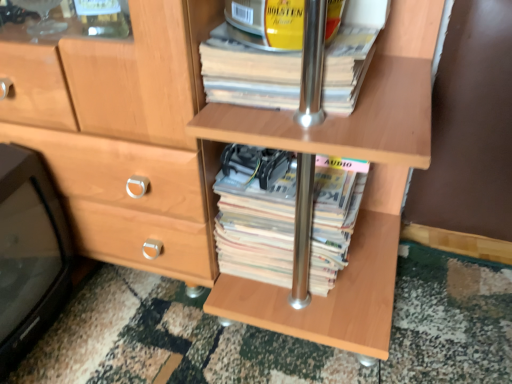
The width and height of the screenshot is (512, 384). Identify the location of black plastic tv at lower left. (29, 253).

Image resolution: width=512 pixels, height=384 pixels. I want to click on white paper at center, the second paperback book viewed from the top, so click(284, 218).

From the picture: What is the approximate width of yellow paper at upper center, placed as the 1th paperback book when sorted from top to bottom?

yellow paper at upper center, placed as the 1th paperback book when sorted from top to bottom, is 12.57 inches wide.

Image resolution: width=512 pixels, height=384 pixels. Identify the location of black plastic tv at lower left. pos(29,253).

At what (x,y) coordinates should I click in order to perform the action: click on paperback book above the white paper at center, placed as the 1th paperback book when sorted from bottom to top (from a real-world perspective). Please return your answer as a coordinate pair (x, y). Looking at the image, I should click on (248, 72).

Which is correct: white paper at center, placed as the 1th paperback book when sorted from bottom to top, is inside yellow paper at upper center, placed as the 1th paperback book when sorted from top to bottom, or outside of it?

white paper at center, placed as the 1th paperback book when sorted from bottom to top, is not enclosed by yellow paper at upper center, placed as the 1th paperback book when sorted from top to bottom.

Between white paper at center, the second paperback book viewed from the top, and yellow paper at upper center, placed as the 1th paperback book when sorted from top to bottom, which one has less height?

Standing shorter between the two is yellow paper at upper center, placed as the 1th paperback book when sorted from top to bottom.

Does point (278, 212) lie in front of point (265, 90)?

No, (278, 212) is further to viewer.

From the image's perspective, count 2nd paperback books upward from the black plastic tv at lower left and point to it. Please provide its 2D coordinates.

[(248, 72)]

From the image's perspective, which is above, yellow paper at upper center, which is the second paperback book from bottom to top, or black plastic tv at lower left?

yellow paper at upper center, which is the second paperback book from bottom to top.

Does yellow paper at upper center, placed as the 1th paperback book when sorted from top to bottom, have a lesser width compared to black plastic tv at lower left?

No.

Does point (292, 55) lie behind point (10, 228)?

No, it is not.

Considering the positions of objects black plastic tv at lower left and yellow paper at upper center, which is the second paperback book from bottom to top, in the image provided, who is more to the right, black plastic tv at lower left or yellow paper at upper center, which is the second paperback book from bottom to top,?

yellow paper at upper center, which is the second paperback book from bottom to top.

Could you measure the distance between black plastic tv at lower left and yellow paper at upper center, which is the second paperback book from bottom to top?

44.70 centimeters.

Based on the photo, is black plastic tv at lower left surrounding yellow paper at upper center, placed as the 1th paperback book when sorted from top to bottom?

No, black plastic tv at lower left does not contain yellow paper at upper center, placed as the 1th paperback book when sorted from top to bottom.

Is black plastic tv at lower left directly adjacent to yellow paper at upper center, placed as the 1th paperback book when sorted from top to bottom?

They are not placed beside each other.

Who is shorter, black plastic tv at lower left or white paper at center, the second paperback book viewed from the top?

white paper at center, the second paperback book viewed from the top, is shorter.

Considering the sizes of objects black plastic tv at lower left and white paper at center, the second paperback book viewed from the top, in the image provided, who is bigger, black plastic tv at lower left or white paper at center, the second paperback book viewed from the top,?

Bigger between the two is black plastic tv at lower left.

Measure the distance between black plastic tv at lower left and white paper at center, placed as the 1th paperback book when sorted from bottom to top.

39.29 centimeters.

From a real-world perspective, is black plastic tv at lower left on white paper at center, the second paperback book viewed from the top?

Indeed, from a real-world perspective, black plastic tv at lower left stands above white paper at center, the second paperback book viewed from the top.

Looking at this image, between yellow paper at upper center, placed as the 1th paperback book when sorted from top to bottom, and white paper at center, placed as the 1th paperback book when sorted from bottom to top, which one is positioned in front?

yellow paper at upper center, placed as the 1th paperback book when sorted from top to bottom, is in front.

Does point (284, 64) lie behind point (222, 188)?

No.

Considering the sizes of objects yellow paper at upper center, which is the second paperback book from bottom to top, and white paper at center, the second paperback book viewed from the top, in the image provided, who is bigger, yellow paper at upper center, which is the second paperback book from bottom to top, or white paper at center, the second paperback book viewed from the top,?

Bigger between the two is white paper at center, the second paperback book viewed from the top.

Can you confirm if yellow paper at upper center, which is the second paperback book from bottom to top, is positioned to the right of white paper at center, the second paperback book viewed from the top?

Incorrect, yellow paper at upper center, which is the second paperback book from bottom to top, is not on the right side of white paper at center, the second paperback book viewed from the top.

Can you confirm if white paper at center, placed as the 1th paperback book when sorted from bottom to top, is wider than black plastic tv at lower left?

Correct, the width of white paper at center, placed as the 1th paperback book when sorted from bottom to top, exceeds that of black plastic tv at lower left.

From the picture: Is white paper at center, the second paperback book viewed from the top, facing away from black plastic tv at lower left?

No.

Is point (266, 242) closer or farther from the camera than point (12, 356)?

Point (266, 242) is farther from the camera than point (12, 356).

From the image's perspective, is white paper at center, the second paperback book viewed from the top, over black plastic tv at lower left?

Yes, from the image's perspective, white paper at center, the second paperback book viewed from the top, is over black plastic tv at lower left.

The height and width of the screenshot is (384, 512). In order to click on paperback book that appears below the yellow paper at upper center, placed as the 1th paperback book when sorted from top to bottom (from the image's perspective) in this screenshot , I will do point(284,218).

You are a GUI agent. You are given a task and a screenshot of the screen. Output one action in this format:
    pyautogui.click(x=<x>, y=<y>)
    Task: Click on the desktop to the left of yellow paper at upper center, which is the second paperback book from bottom to top
    The height and width of the screenshot is (384, 512).
    Given the screenshot: What is the action you would take?
    pyautogui.click(x=29, y=253)

From the image, which object appears to be nearer to yellow paper at upper center, placed as the 1th paperback book when sorted from top to bottom, white paper at center, placed as the 1th paperback book when sorted from bottom to top, or black plastic tv at lower left?

Among the two, white paper at center, placed as the 1th paperback book when sorted from bottom to top, is located nearer to yellow paper at upper center, placed as the 1th paperback book when sorted from top to bottom.

Estimate the real-world distances between objects in this image. Which object is further from black plastic tv at lower left, white paper at center, the second paperback book viewed from the top, or yellow paper at upper center, which is the second paperback book from bottom to top?

yellow paper at upper center, which is the second paperback book from bottom to top, is further to black plastic tv at lower left.

Considering their positions, is black plastic tv at lower left positioned further to yellow paper at upper center, placed as the 1th paperback book when sorted from top to bottom, than white paper at center, the second paperback book viewed from the top?

black plastic tv at lower left lies further to yellow paper at upper center, placed as the 1th paperback book when sorted from top to bottom, than the other object.

In the scene shown: Estimate the real-world distances between objects in this image. Which object is closer to black plastic tv at lower left, yellow paper at upper center, which is the second paperback book from bottom to top, or white paper at center, the second paperback book viewed from the top?

Based on the image, white paper at center, the second paperback book viewed from the top, appears to be nearer to black plastic tv at lower left.

From the image, which object appears to be nearer to white paper at center, placed as the 1th paperback book when sorted from bottom to top, yellow paper at upper center, placed as the 1th paperback book when sorted from top to bottom, or black plastic tv at lower left?

The object closer to white paper at center, placed as the 1th paperback book when sorted from bottom to top, is yellow paper at upper center, placed as the 1th paperback book when sorted from top to bottom.

When comparing their distances from white paper at center, placed as the 1th paperback book when sorted from bottom to top, does black plastic tv at lower left or yellow paper at upper center, placed as the 1th paperback book when sorted from top to bottom, seem closer?

yellow paper at upper center, placed as the 1th paperback book when sorted from top to bottom, is positioned closer to the anchor white paper at center, placed as the 1th paperback book when sorted from bottom to top.

I want to click on paperback book between black plastic tv at lower left and white paper at center, the second paperback book viewed from the top, from left to right, so click(248, 72).